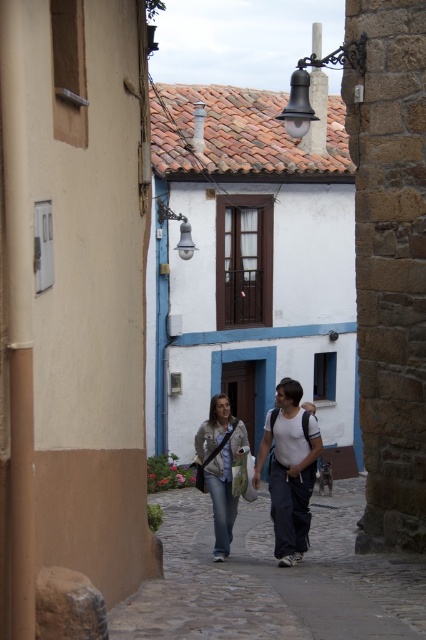
You are a delivery person carrying a package that requires a 30 inch clearance to maneuver safely. You see the denim jeans at center and the denim jacket at center in the narrow cobblestone street. Can you safely navigate between them with your package?

The denim jeans at center and denim jacket at center are 32.17 inches apart from each other. Since the required clearance is 30 inches, you can safely navigate between them with your package as the space is sufficient.

You are a tourist walking along the cobblestone street and spot both the denim jeans at center and the denim jacket at center. Which item is closer to you as you face the street?

The denim jeans at center is closer to you because it is in front of the denim jacket at center.

You are a traveler standing in the middle of the cobblestone street and you see both the denim jeans at center and the denim jacket at center. Which clothing item is covering the other one?

The denim jeans at center is positioned over the denim jacket at center, meaning the jeans are covering the jacket.